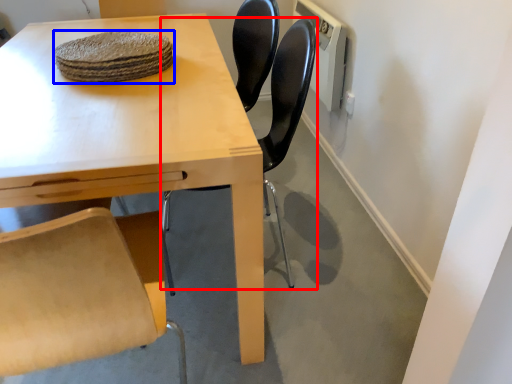
Question: Which object appears closest to the camera in this image, chair (highlighted by a red box) or food (highlighted by a blue box)?

Choices:
 (A) chair
 (B) food

Answer: (A)